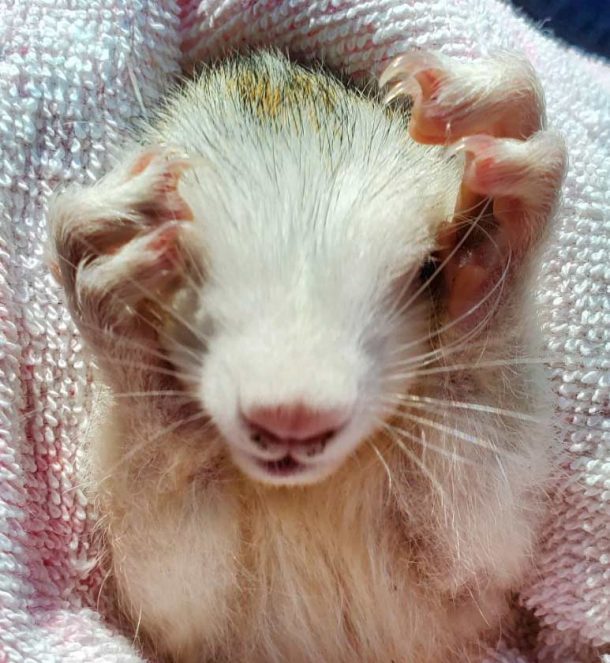
The height and width of the screenshot is (663, 610). I want to click on white fur, so click(493, 538), click(173, 593), click(279, 329).